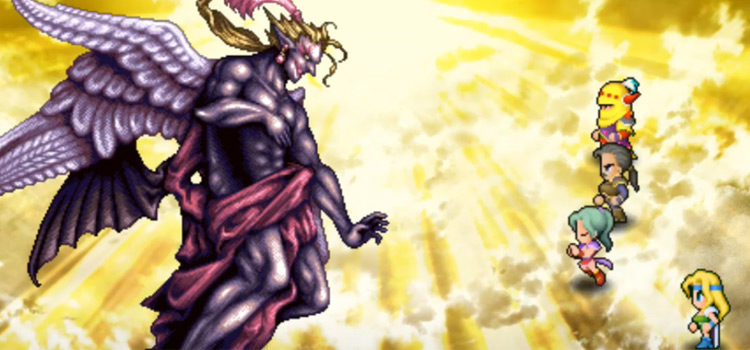
You are a GUI agent. You are given a task and a screenshot of the screen. Output one action in this format:
    pyautogui.click(x=<x>, y=<y>)
    Task: Click on the robe
    This screenshot has height=350, width=750.
    Given the screenshot: What is the action you would take?
    pyautogui.click(x=270, y=189)